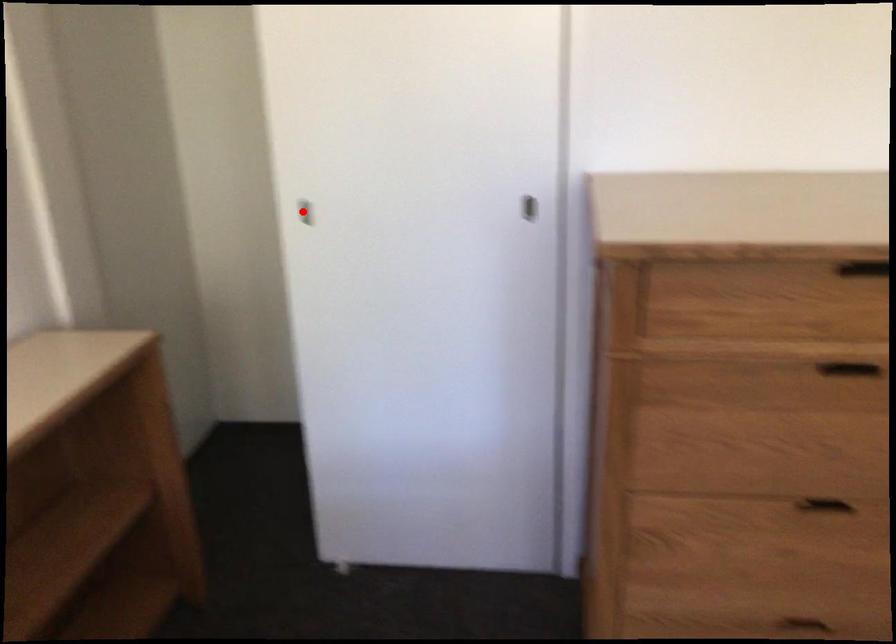
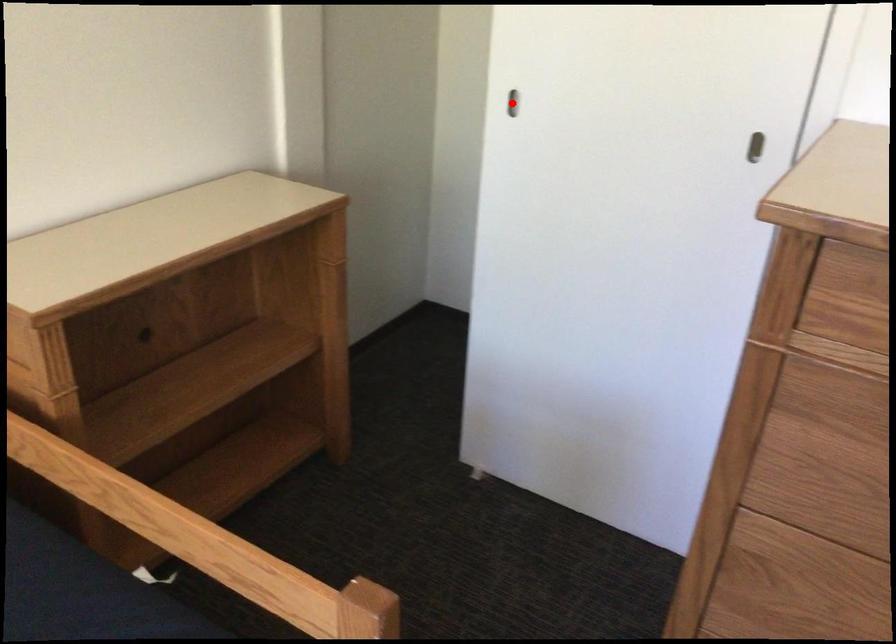
I am providing you with two images of the same scene from different viewpoints. A red point is marked on the first image and another point is marked on the second image. Are the points marked in image1 and image2 representing the same 3D position?

Yes